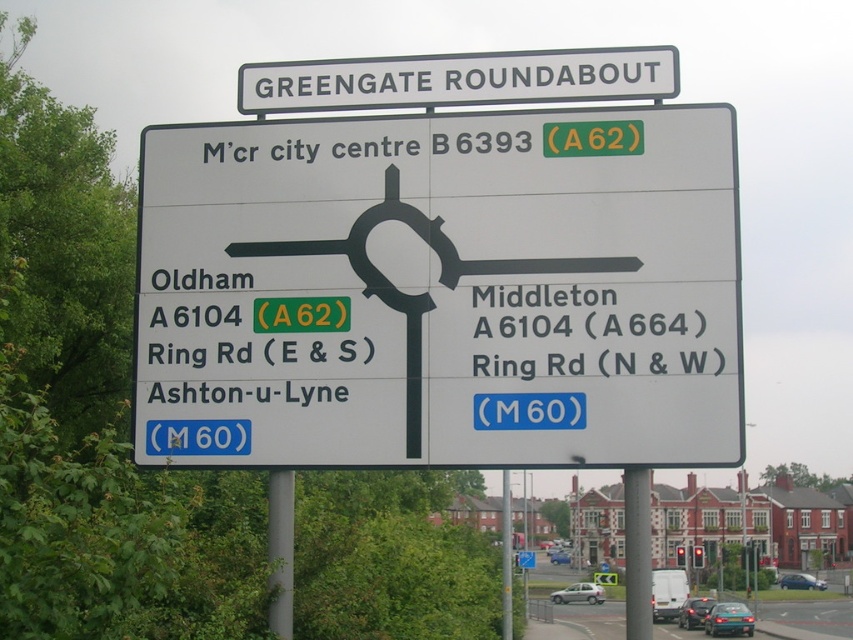
Consider the image. Does metallic pole at center have a lesser height compared to blue metallic car at center?

In fact, metallic pole at center may be taller than blue metallic car at center.

Is metallic pole at center above blue metallic car at center?

Yes, metallic pole at center is above blue metallic car at center.

Between point (508, 508) and point (566, 563), which one is positioned in front?

Positioned in front is point (508, 508).

Image resolution: width=853 pixels, height=640 pixels. Find the location of `metallic pole at center`. metallic pole at center is located at coordinates (506, 557).

Is black text on white sign at right closer to the viewer compared to silver metallic hatchback at center?

Yes, black text on white sign at right is closer to the viewer.

Which is behind, point (630, 314) or point (579, 589)?

Positioned behind is point (579, 589).

Find the location of a particular element. This screenshot has width=853, height=640. black text on white sign at right is located at coordinates (596, 324).

At what (x,y) coordinates should I click in order to perform the action: click on black text on white sign at right. Please return your answer as a coordinate pair (x, y). Looking at the image, I should click on (596, 324).

Between metallic pole at center and silver metallic hatchback at center, which one appears on the right side from the viewer's perspective?

From the viewer's perspective, silver metallic hatchback at center appears more on the right side.

Which of these two, metallic pole at center or silver metallic hatchback at center, stands taller?

With more height is metallic pole at center.

The width and height of the screenshot is (853, 640). What are the coordinates of `metallic pole at center` in the screenshot? It's located at (506, 557).

Locate an element on the screen. metallic pole at center is located at coordinates (506, 557).